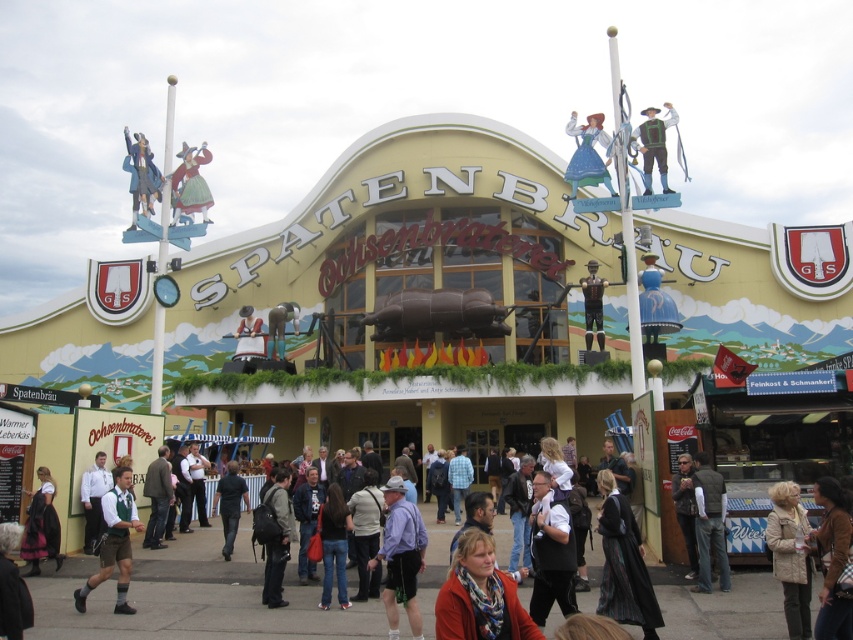
Question: Which point is closer to the camera taking this photo?

Choices:
 (A) (642, 170)
 (B) (717, 541)

Answer: (B)

Question: Which point is farther to the camera?

Choices:
 (A) dark blue shirt at center
 (B) matte yellow dress at upper center

Answer: (B)

Question: Which object is positioned farthest from the matte black figure at upper left?

Choices:
 (A) blue fabric dress at upper center
 (B) dark blue shirt at center

Answer: (A)

Question: Does blue fabric dress at upper center lie in front of wooden figure at center?

Choices:
 (A) no
 (B) yes

Answer: (B)

Question: Can you confirm if black wool coat at center is wider than matte black figure at upper left?

Choices:
 (A) no
 (B) yes

Answer: (A)

Question: Is tan suede jacket at lower right wider than matte black figure at upper left?

Choices:
 (A) no
 (B) yes

Answer: (A)